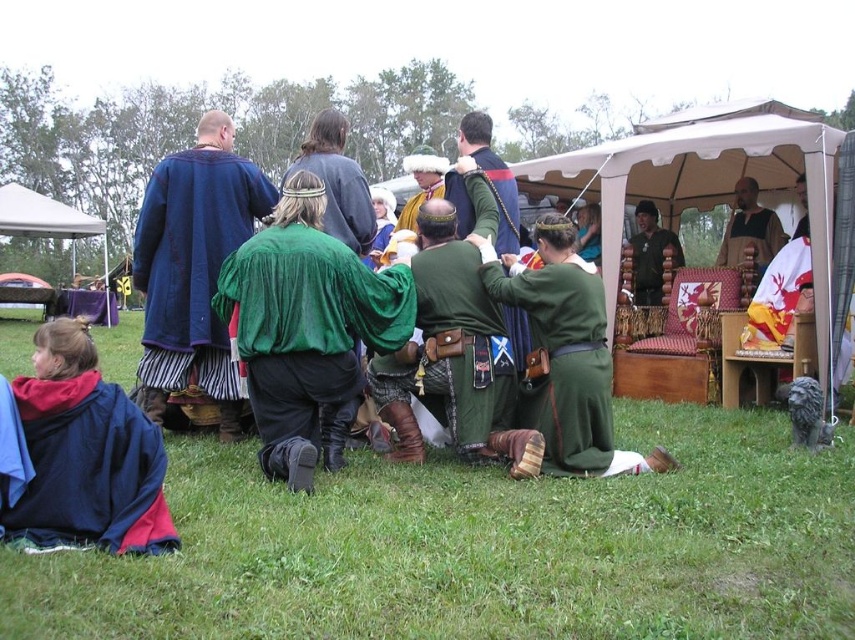
Measure the distance between wooden chair at center and leather belt at center.

A distance of 81.82 centimeters exists between wooden chair at center and leather belt at center.

I want to click on wooden chair at center, so click(x=705, y=179).

Which is behind, point (446, 326) or point (511, 292)?

The point (446, 326) is more distant.

Who is higher up, green leather boots at center or green fabric pants at center?

green leather boots at center is higher up.

At what (x,y) coordinates should I click in order to perform the action: click on green leather boots at center. Please return your answer as a coordinate pair (x, y). Looking at the image, I should click on [453, 356].

Between green fabric pants at center and velvet blue robe at center, which one has more height?

velvet blue robe at center is taller.

Identify the location of green fabric pants at center. (565, 365).